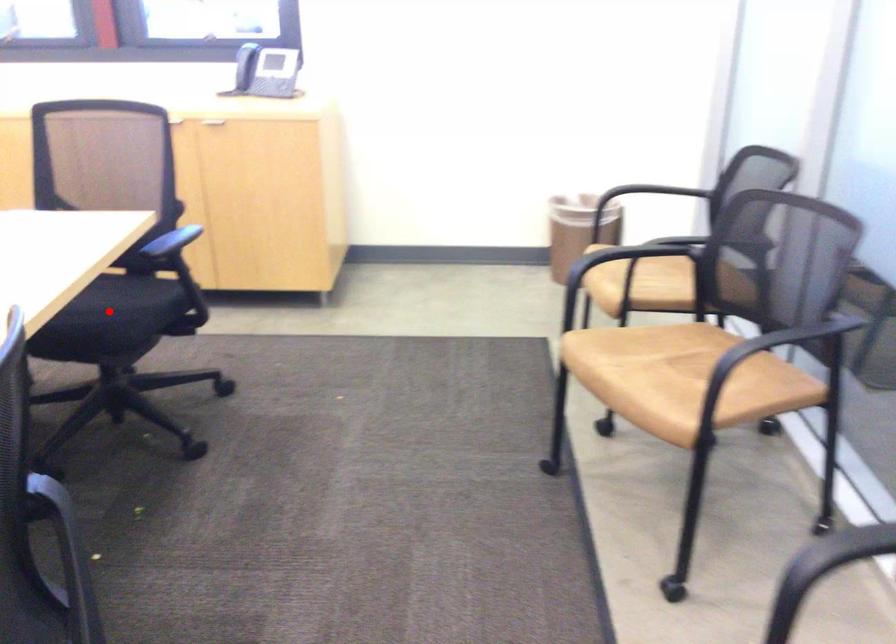
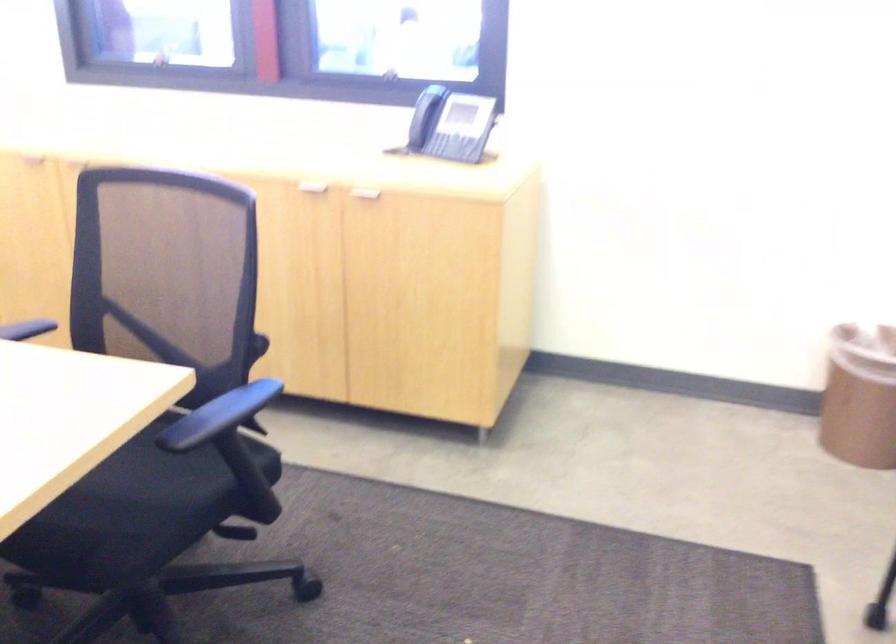
Question: I am providing you with two images of the same scene from different viewpoints. A red point is marked on the first image. Can you still see the location of the red point in image 2?

Choices:
 (A) Yes
 (B) No

Answer: (A)